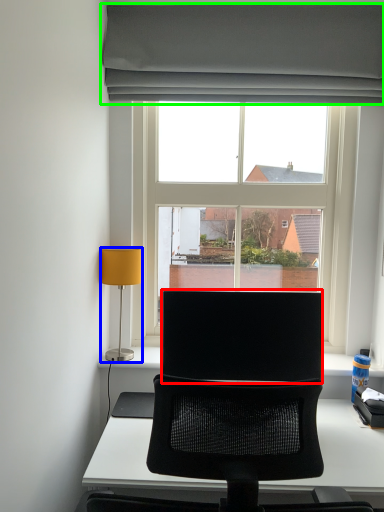
Question: Based on their relative distances, which object is farther from computer monitor (highlighted by a red box)? Choose from lamp (highlighted by a blue box) and curtain (highlighted by a green box).

Choices:
 (A) lamp
 (B) curtain

Answer: (B)